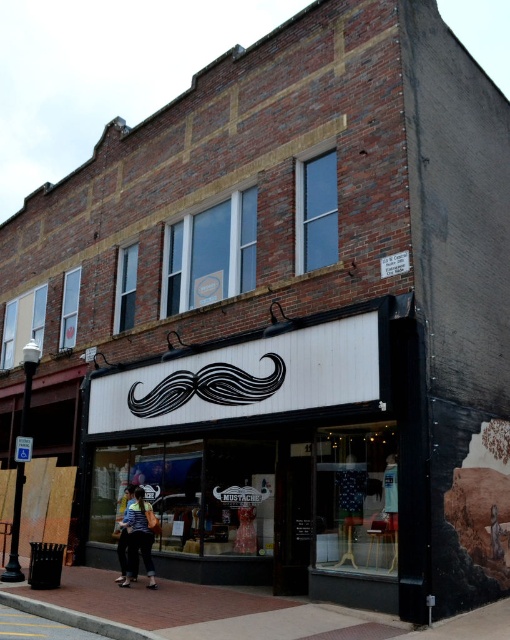
Is striped shirt at center bigger than denim jacket at lower left?

No, striped shirt at center is not bigger than denim jacket at lower left.

Is point (138, 524) positioned in front of point (119, 561)?

Yes, it is in front of point (119, 561).

Locate an element on the screen. striped shirt at center is located at coordinates (139, 538).

Is white matte signboard at center shorter than brick pavement at lower center?

No.

Is point (372, 580) in front of point (36, 602)?

Yes, it is.

Based on the photo, who is more distant from viewer, (338, 560) or (217, 630)?

Point (338, 560)

You are a GUI agent. You are given a task and a screenshot of the screen. Output one action in this format:
    pyautogui.click(x=<x>, y=<y>)
    Task: Click on the white matte signboard at center
    This screenshot has width=510, height=640.
    Given the screenshot: What is the action you would take?
    pyautogui.click(x=274, y=456)

Does brick pavement at lower center have a lesser height compared to striped shirt at center?

Indeed, brick pavement at lower center has a lesser height compared to striped shirt at center.

Which of these two, brick pavement at lower center or striped shirt at center, stands taller?

With more height is striped shirt at center.

The image size is (510, 640). I want to click on brick pavement at lower center, so click(x=218, y=612).

I want to click on brick pavement at lower center, so click(218, 612).